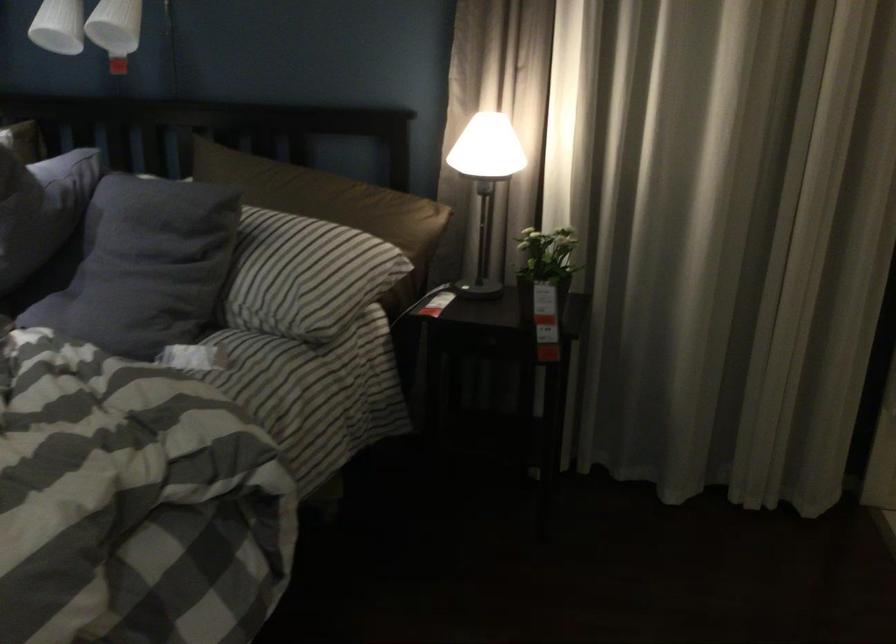
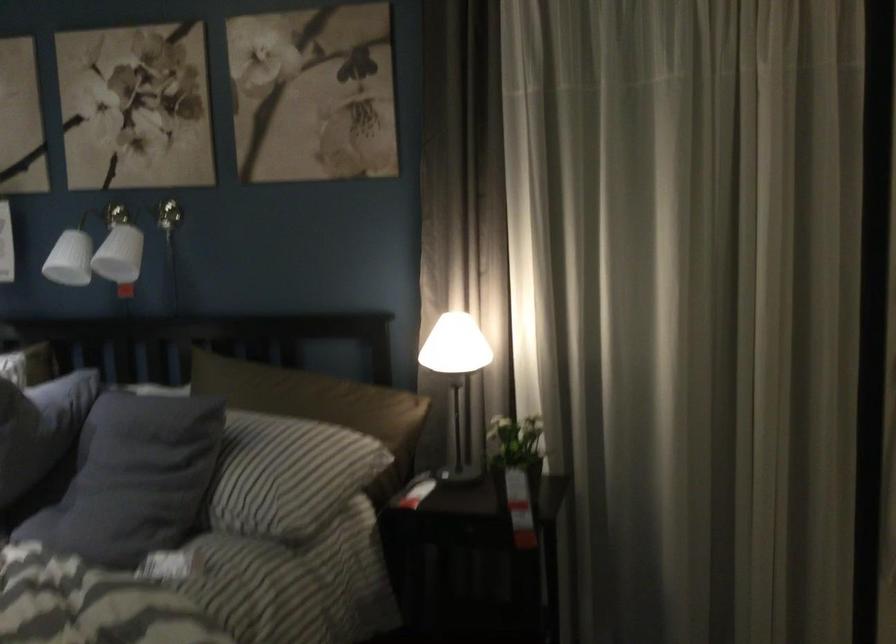
Locate, in the second image, the point that corresponds to [487,180] in the first image.

(455, 375)